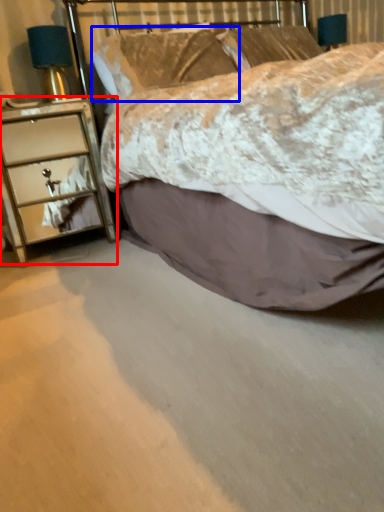
Question: Which object is further to the camera taking this photo, chest of drawers (highlighted by a red box) or pillow (highlighted by a blue box)?

Choices:
 (A) chest of drawers
 (B) pillow

Answer: (B)